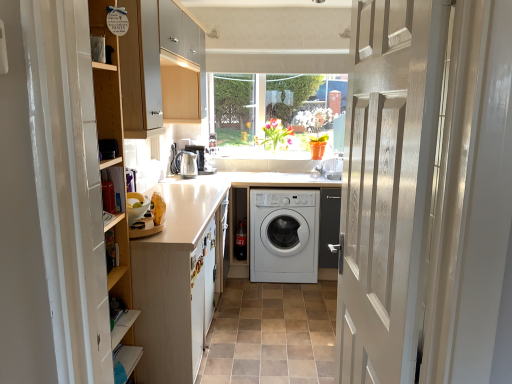
Question: Does white matte washing machine at center have a lesser width compared to white matte washer at center?

Choices:
 (A) yes
 (B) no

Answer: (A)

Question: Does white matte washing machine at center lie behind white matte washer at center?

Choices:
 (A) no
 (B) yes

Answer: (B)

Question: Is white matte washing machine at center wider than white matte washer at center?

Choices:
 (A) no
 (B) yes

Answer: (A)

Question: Is white matte washing machine at center turned away from white matte washer at center?

Choices:
 (A) no
 (B) yes

Answer: (A)

Question: From the image's perspective, does white matte washing machine at center appear lower than white matte washer at center?

Choices:
 (A) no
 (B) yes

Answer: (A)

Question: Relative to white matte washing machine at center, is white wood door at center in front or behind?

Choices:
 (A) behind
 (B) front

Answer: (B)

Question: Is white wood door at center inside or outside of white matte washing machine at center?

Choices:
 (A) outside
 (B) inside

Answer: (A)

Question: In the image, is white wood door at center on the left side or the right side of white matte washing machine at center?

Choices:
 (A) left
 (B) right

Answer: (B)

Question: In terms of width, does white wood door at center look wider or thinner when compared to white matte washing machine at center?

Choices:
 (A) thin
 (B) wide

Answer: (A)

Question: Based on their sizes in the image, would you say white matte cabinet at left is bigger or smaller than satin silver kettle at center?

Choices:
 (A) big
 (B) small

Answer: (A)

Question: Is white matte cabinet at left taller or shorter than satin silver kettle at center?

Choices:
 (A) short
 (B) tall

Answer: (B)

Question: In the image, is white matte cabinet at left positioned in front of or behind satin silver kettle at center?

Choices:
 (A) behind
 (B) front

Answer: (B)

Question: From a real-world perspective, is white matte cabinet at left positioned above or below satin silver kettle at center?

Choices:
 (A) above
 (B) below

Answer: (B)

Question: Based on their sizes in the image, would you say white wood door at center is bigger or smaller than white matte washer at center?

Choices:
 (A) small
 (B) big

Answer: (B)

Question: In the image, is white wood door at center on the left side or the right side of white matte washer at center?

Choices:
 (A) left
 (B) right

Answer: (B)